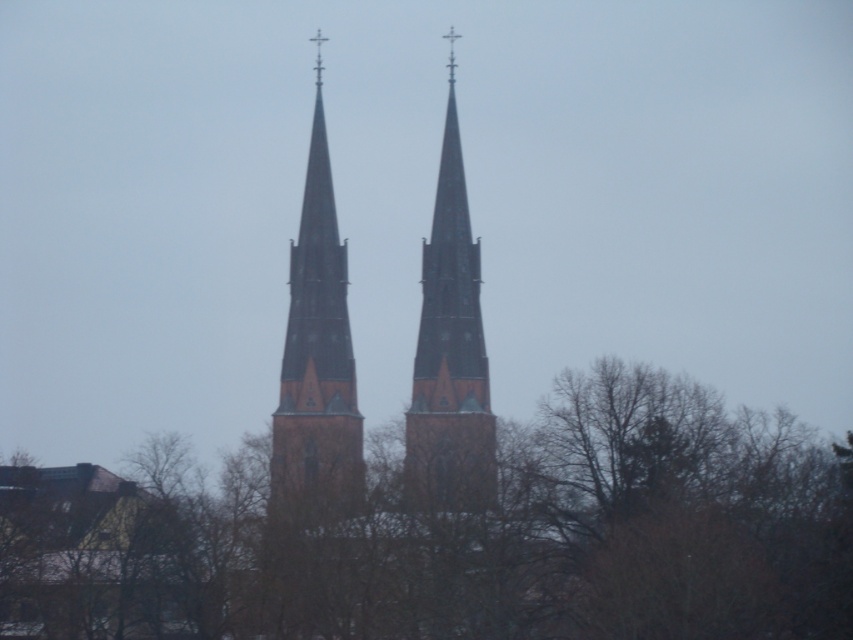
You are a photographer planning to capture a wide shot of the brown leafless tree at center and the brown stone tower at center. Based on their widths, which object should you focus on to ensure both fit in the frame without cropping?

The brown leafless tree at center might be wider than brown stone tower at center, so focusing on the tree would ensure both fit without cropping since it is the wider object.

You are standing at the base of the church spires and want to take a photo of the brown leafless tree at center. Which direction should you face to capture the tree in the foreground with the spires in the background?

The brown leafless tree at center is positioned at point (476, 536), which means it is located towards the center of the image. To capture the tree in the foreground with the spires in the background, you should face towards the center of the scene where the tree is situated, ensuring both elements are framed appropriately.

You are standing in front of the church with two spires. You notice two points marked on the image. The first point is at coordinates point (215, 506) and the second is at point (323, 196). Which point is closer to you?

Point (215, 506) is in front of point (323, 196), so the first point is closer to you.